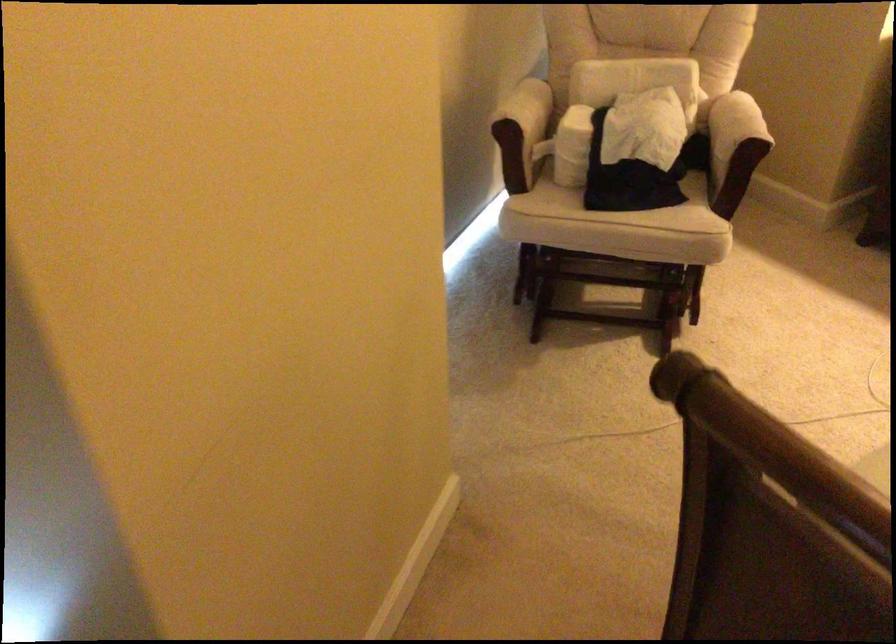
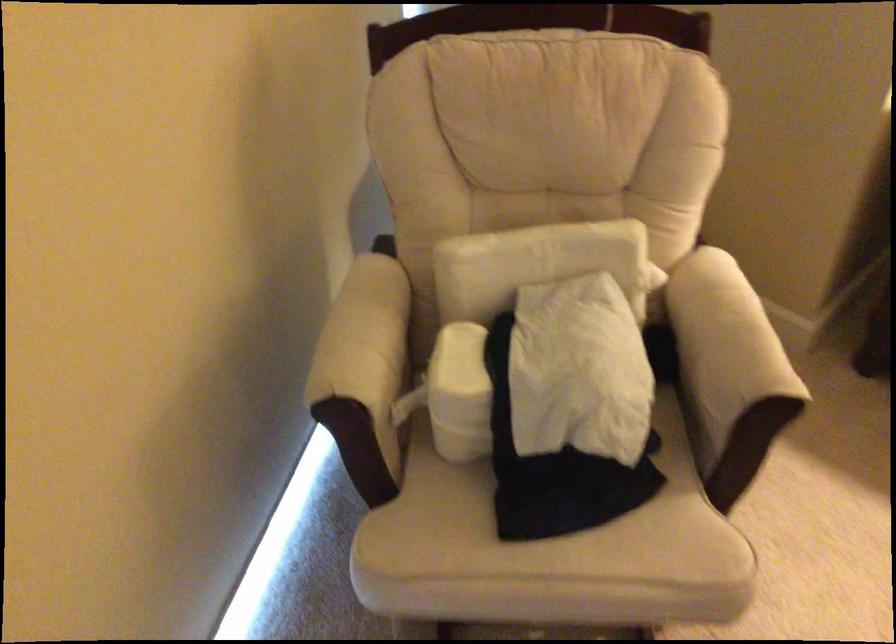
In the second image, find the point that corresponds to the point at 632,76 in the first image.

(533, 263)